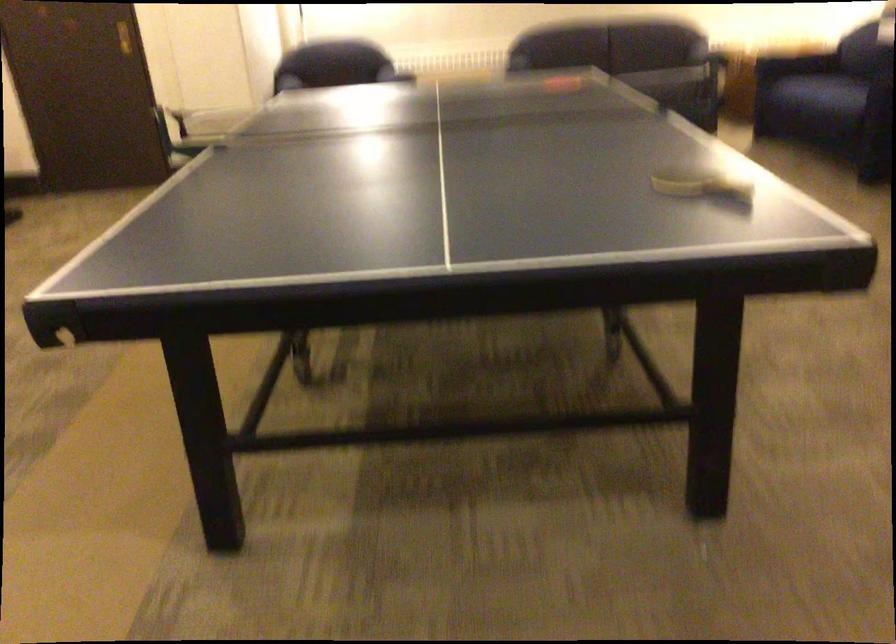
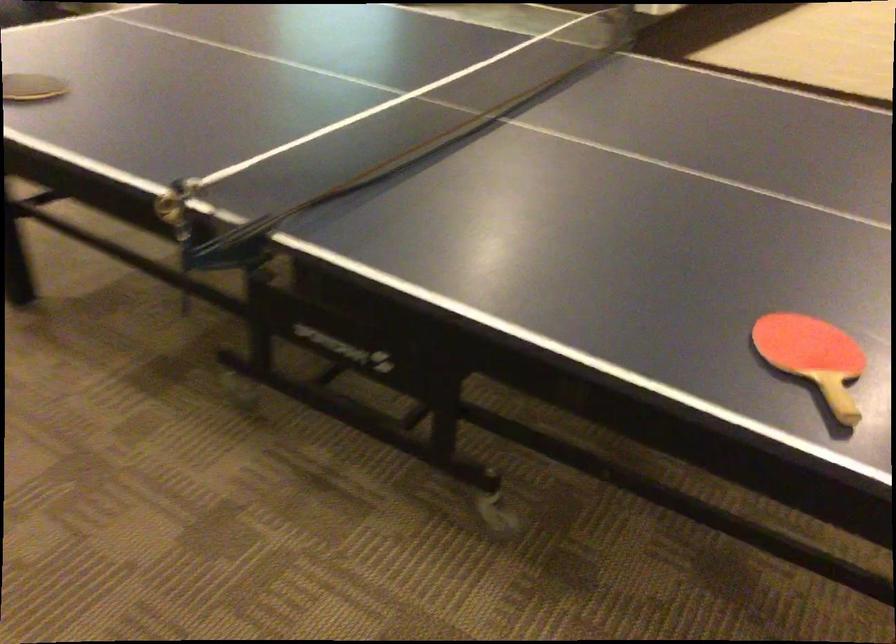
Find the pixel in the second image that matches (677,73) in the first image.

(174, 207)